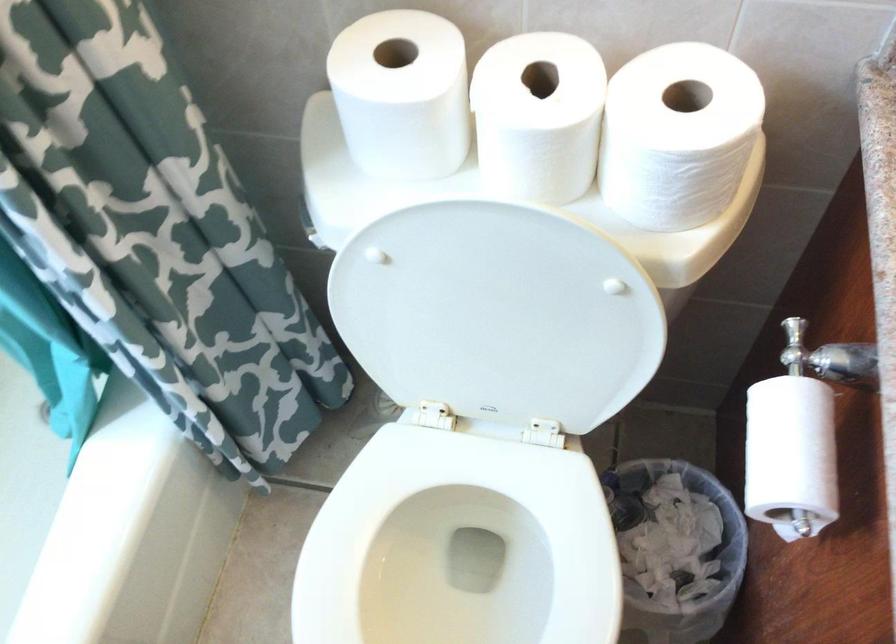
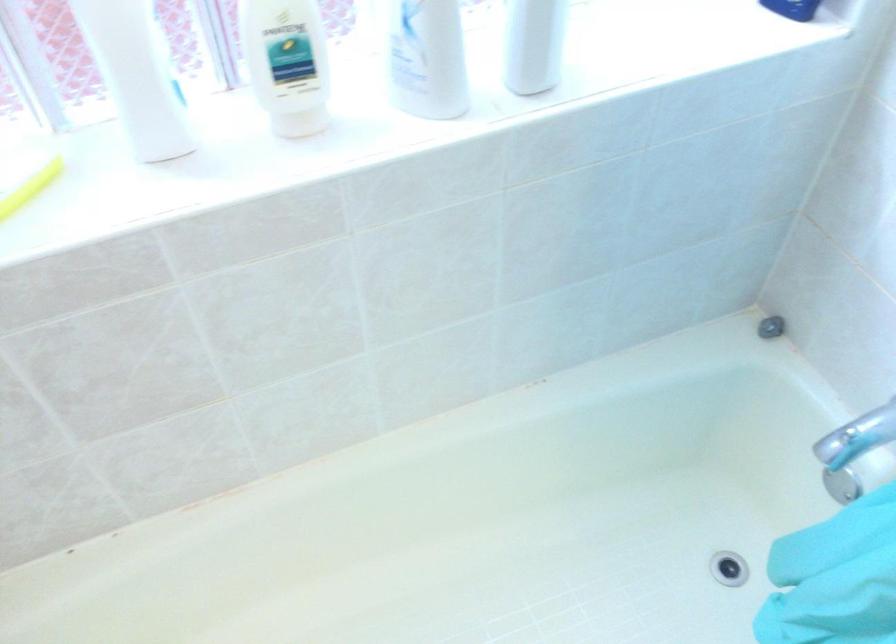
Question: The images are taken continuously from a first-person perspective. In which direction is your viewpoint rotating?

Choices:
 (A) Left
 (B) Right
 (C) Up
 (D) Down

Answer: (A)